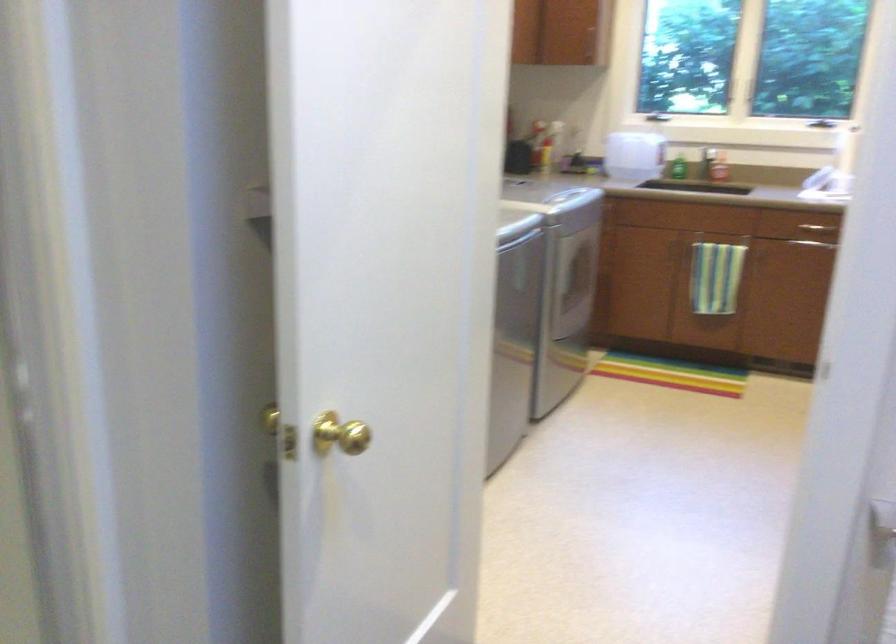
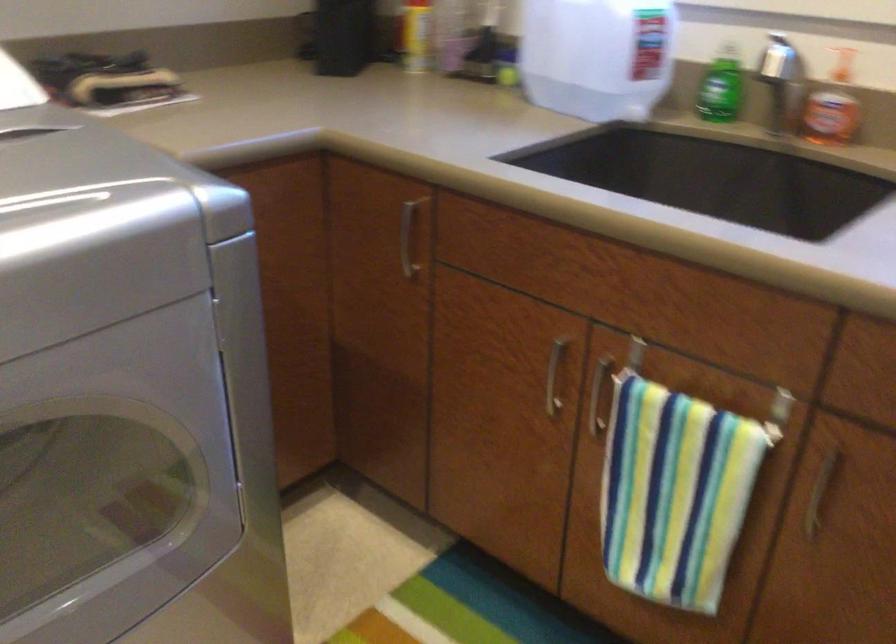
The point at (x=705, y=160) is marked in the first image. Where is the corresponding point in the second image?

(788, 96)